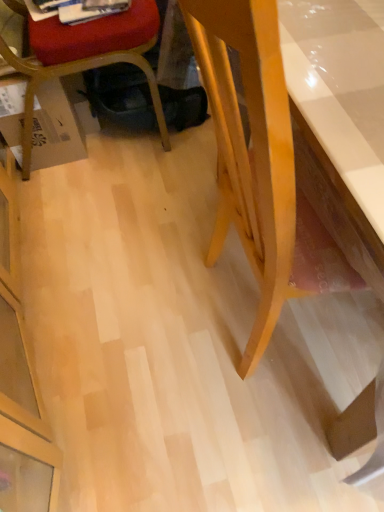
Question: From the image's perspective, is white glossy magazine at upper left on light wood desk at right?

Choices:
 (A) yes
 (B) no

Answer: (A)

Question: Is the depth of white glossy magazine at upper left less than that of light wood desk at right?

Choices:
 (A) yes
 (B) no

Answer: (B)

Question: Is white glossy magazine at upper left not near light wood desk at right?

Choices:
 (A) yes
 (B) no

Answer: (B)

Question: Considering the relative sizes of white glossy magazine at upper left and light wood desk at right in the image provided, is white glossy magazine at upper left smaller than light wood desk at right?

Choices:
 (A) no
 (B) yes

Answer: (B)

Question: Is white glossy magazine at upper left thinner than light wood desk at right?

Choices:
 (A) no
 (B) yes

Answer: (B)

Question: Which is correct: brown cardboard box at lower left is inside matte plastic chair at lower left, or outside of it?

Choices:
 (A) outside
 (B) inside

Answer: (B)

Question: Would you say brown cardboard box at lower left is to the left or to the right of matte plastic chair at lower left in the picture?

Choices:
 (A) left
 (B) right

Answer: (A)

Question: Considering their positions, is brown cardboard box at lower left located in front of or behind matte plastic chair at lower left?

Choices:
 (A) front
 (B) behind

Answer: (B)

Question: From the image's perspective, relative to matte plastic chair at lower left, is brown cardboard box at lower left above or below?

Choices:
 (A) below
 (B) above

Answer: (A)

Question: Looking at their shapes, would you say brown cardboard box at lower left is wider or thinner than white glossy magazine at upper left?

Choices:
 (A) thin
 (B) wide

Answer: (B)

Question: From a real-world perspective, relative to white glossy magazine at upper left, is brown cardboard box at lower left vertically above or below?

Choices:
 (A) above
 (B) below

Answer: (B)

Question: Considering their positions, is brown cardboard box at lower left located in front of or behind white glossy magazine at upper left?

Choices:
 (A) behind
 (B) front

Answer: (A)

Question: From the image's perspective, is brown cardboard box at lower left located above or below white glossy magazine at upper left?

Choices:
 (A) below
 (B) above

Answer: (A)

Question: Looking at their shapes, would you say white glossy magazine at upper left is wider or thinner than brown cardboard box at lower left?

Choices:
 (A) wide
 (B) thin

Answer: (B)

Question: Based on their sizes in the image, would you say white glossy magazine at upper left is bigger or smaller than brown cardboard box at lower left?

Choices:
 (A) small
 (B) big

Answer: (A)